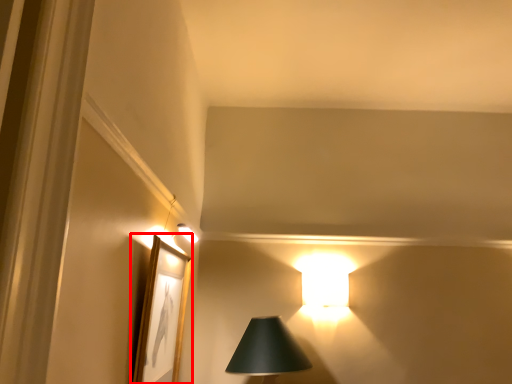
Question: In this image, where is picture frame (annotated by the red box) located relative to lamp?

Choices:
 (A) left
 (B) right

Answer: (A)